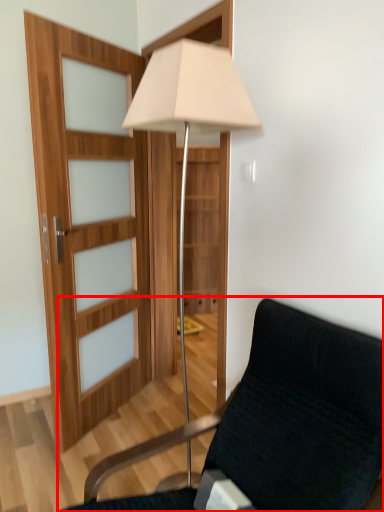
Question: Where is chair (annotated by the red box) located in relation to lamp in the image?

Choices:
 (A) left
 (B) right

Answer: (B)